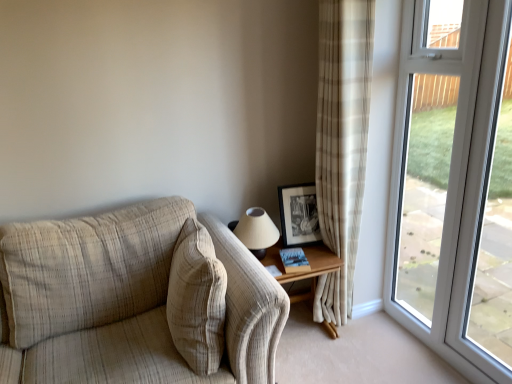
Locate an element on the screen. The width and height of the screenshot is (512, 384). spots to the right of wooden table at right is located at coordinates (375, 339).